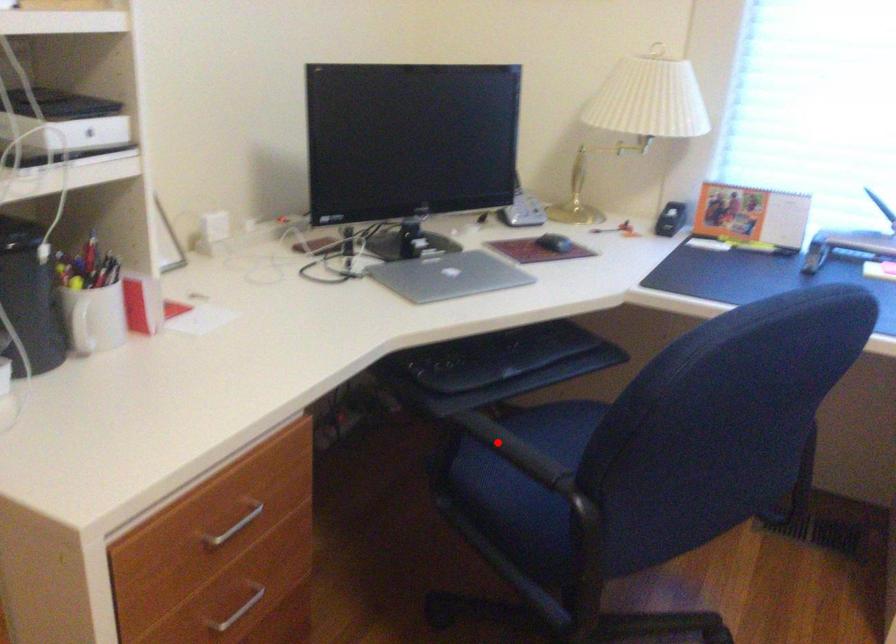
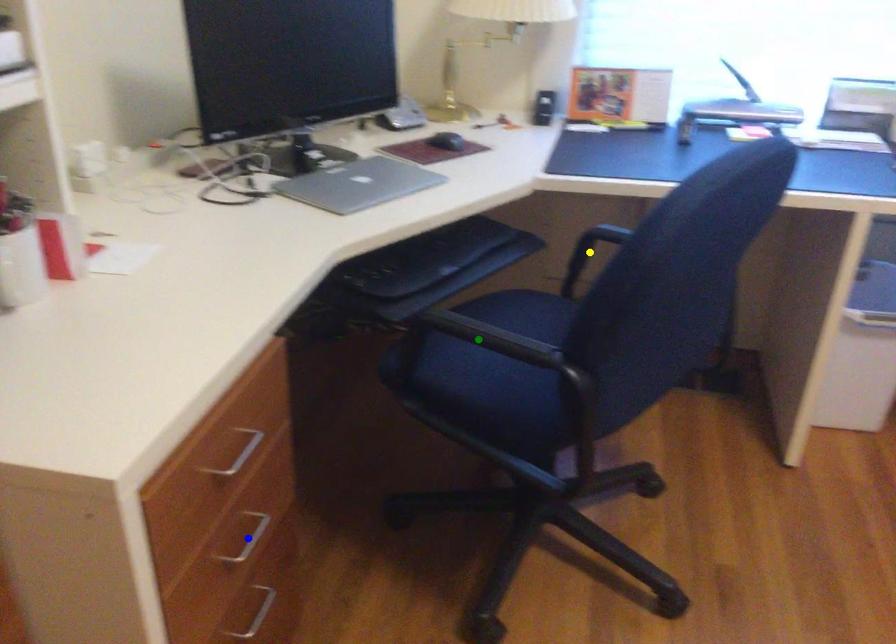
Question: I am providing you with two images of the same scene from different viewpoints. A red point is marked on the first image. You are given multiple points on the second image. Which point in image 2 represents the same 3d spot as the red point in image 1?

Choices:
 (A) blue point
 (B) yellow point
 (C) green point

Answer: (C)